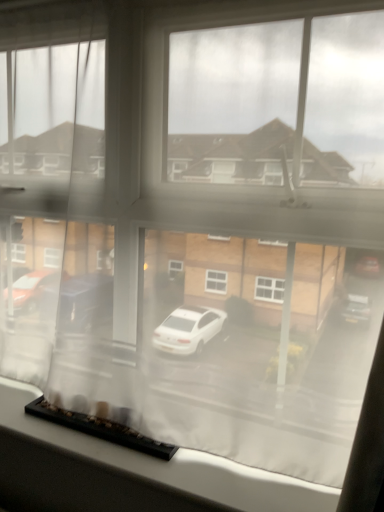
The image size is (384, 512). I want to click on black plastic tray at lower center, so click(129, 472).

This screenshot has height=512, width=384. What do you see at coordinates (129, 472) in the screenshot? I see `black plastic tray at lower center` at bounding box center [129, 472].

This screenshot has height=512, width=384. In order to click on black plastic tray at lower center in this screenshot , I will do `click(129, 472)`.